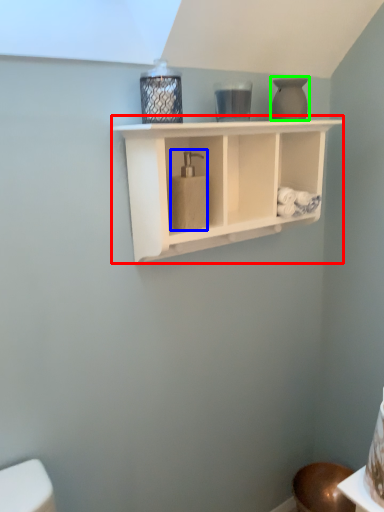
Question: Based on their relative distances, which object is farther from shelf (highlighted by a red box)? Choose from soap dispenser (highlighted by a blue box) and vase (highlighted by a green box).

Choices:
 (A) soap dispenser
 (B) vase

Answer: (B)